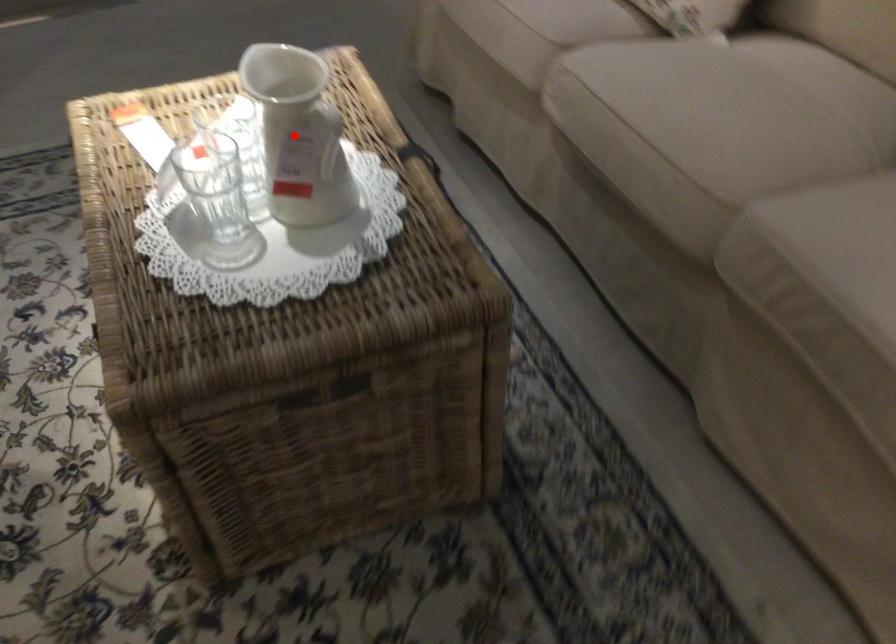
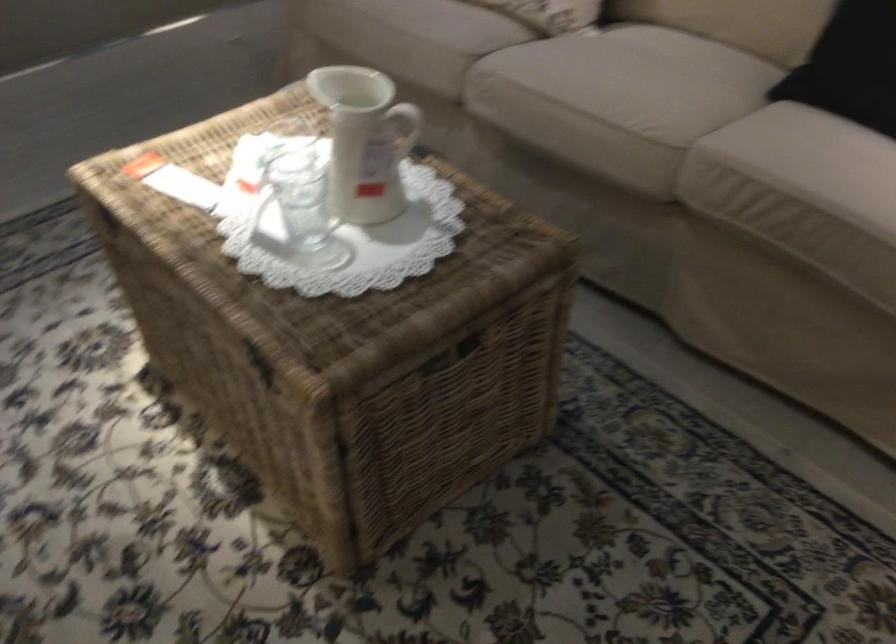
Question: I am providing you with two images of the same scene from different viewpoints. A red point is marked on the first image. At the location where the point appears in image 1, is it still visible in image 2?

Choices:
 (A) Yes
 (B) No

Answer: (A)